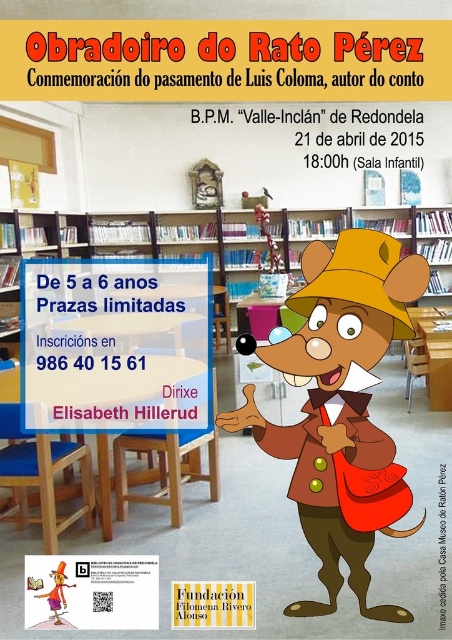
You are looking at the promotional poster for the event. The brown fabric mouse at center and the wooden bookshelf at center are both in the image. Which object is positioned closer to you?

The brown fabric mouse at center is closer to the viewer than the wooden bookshelf at center.